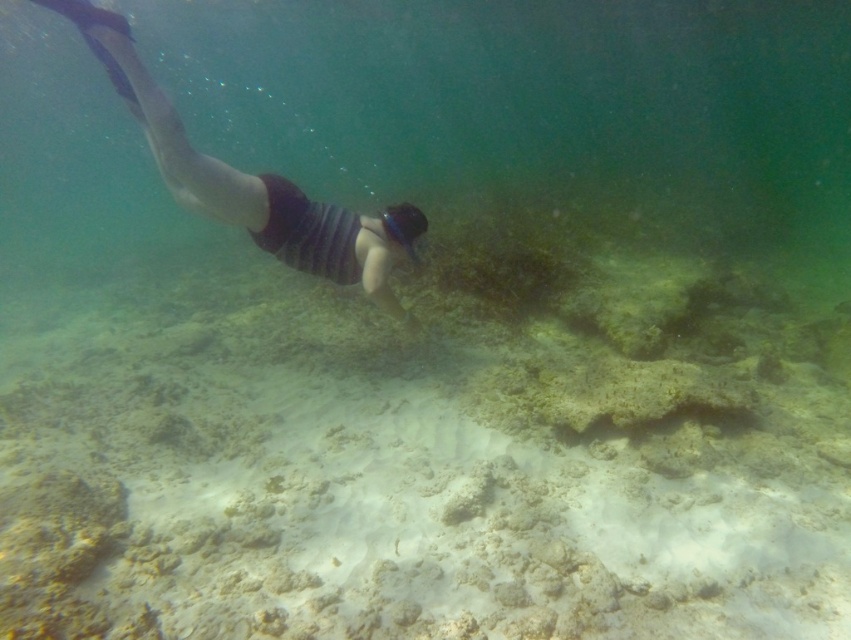
Does striped fabric snorkeler at upper left come in front of transparent plastic goggles at center?

Yes.

Locate an element on the screen. striped fabric snorkeler at upper left is located at coordinates (241, 179).

Who is more forward, (198, 173) or (406, 211)?

Point (198, 173) is in front.

The width and height of the screenshot is (851, 640). In order to click on striped fabric snorkeler at upper left in this screenshot , I will do `click(241, 179)`.